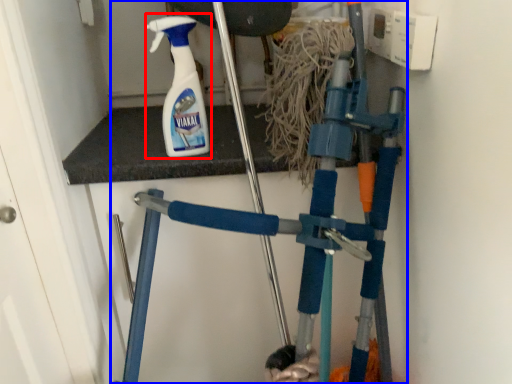
Question: Which point is closer to the camera, cleaning product (highlighted by a red box) or crutch (highlighted by a blue box)?

Choices:
 (A) cleaning product
 (B) crutch

Answer: (A)